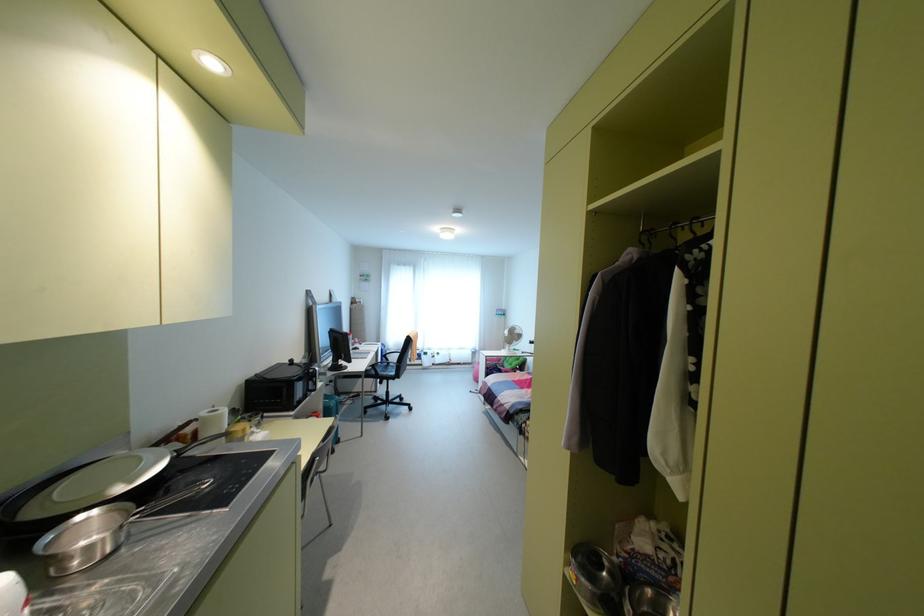
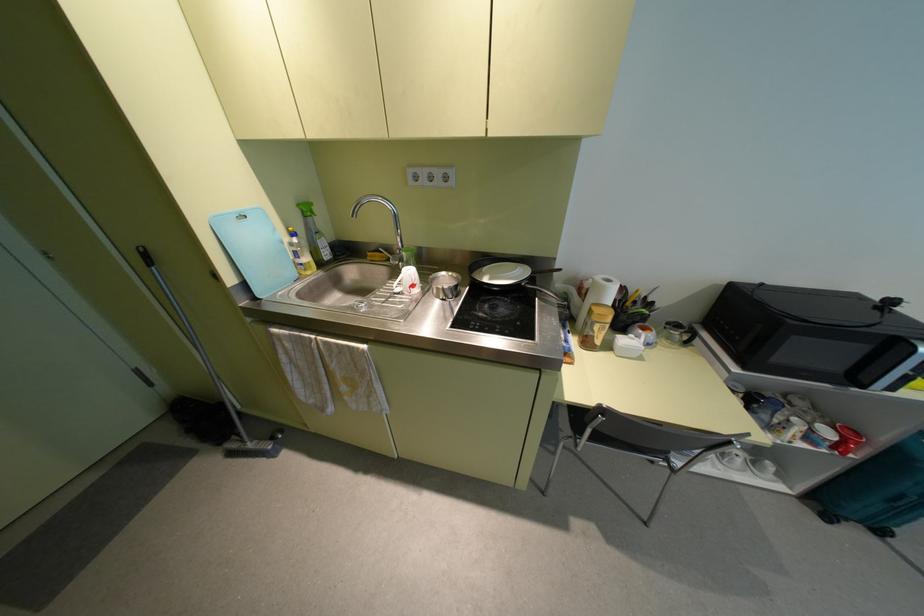
Where in the second image is the point corresponding to (x=203, y=413) from the first image?

(599, 277)